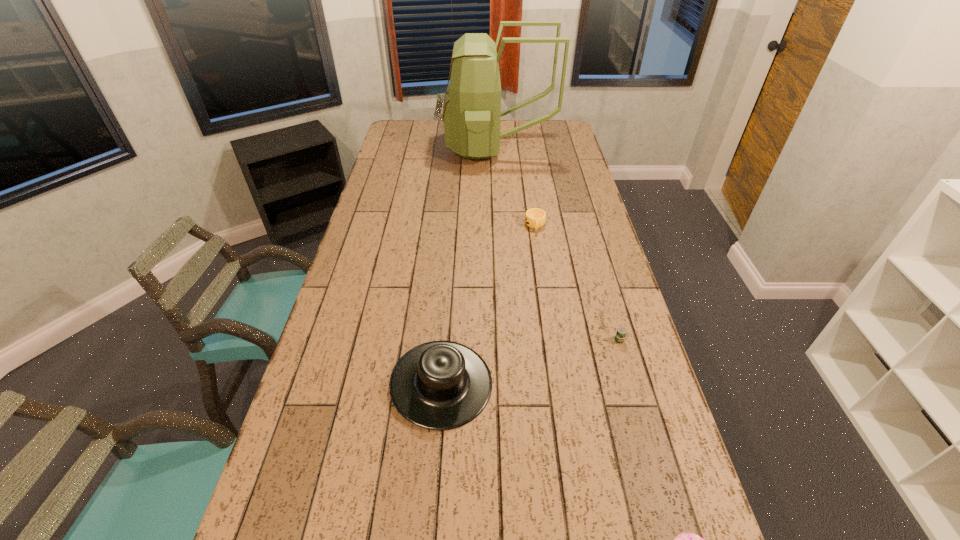
Find the location of a particular element. This screenshot has height=540, width=960. backpack is located at coordinates (471, 114).

The height and width of the screenshot is (540, 960). Identify the location of the farthest object. (471, 114).

Image resolution: width=960 pixels, height=540 pixels. Find the location of `the fourth farthest object`. the fourth farthest object is located at coordinates (440, 385).

Where is `the second tallest object`? Image resolution: width=960 pixels, height=540 pixels. the second tallest object is located at coordinates (440, 385).

This screenshot has height=540, width=960. In order to click on the fourth nearest object in this screenshot , I will do `click(535, 218)`.

Where is `the third farthest object`? The height and width of the screenshot is (540, 960). the third farthest object is located at coordinates coord(620,335).

Image resolution: width=960 pixels, height=540 pixels. What are the coordinates of `vacant space positioned 0.140m on the front pocket of the backpack` in the screenshot? It's located at (417, 148).

This screenshot has width=960, height=540. I want to click on vacant point located on the front pocket of the backpack, so pos(388,148).

Locate an element on the screen. free space located on the front pocket of the backpack is located at coordinates (412, 148).

Find the location of `free spot located on the back of the fourth farthest object`. free spot located on the back of the fourth farthest object is located at coordinates (446, 318).